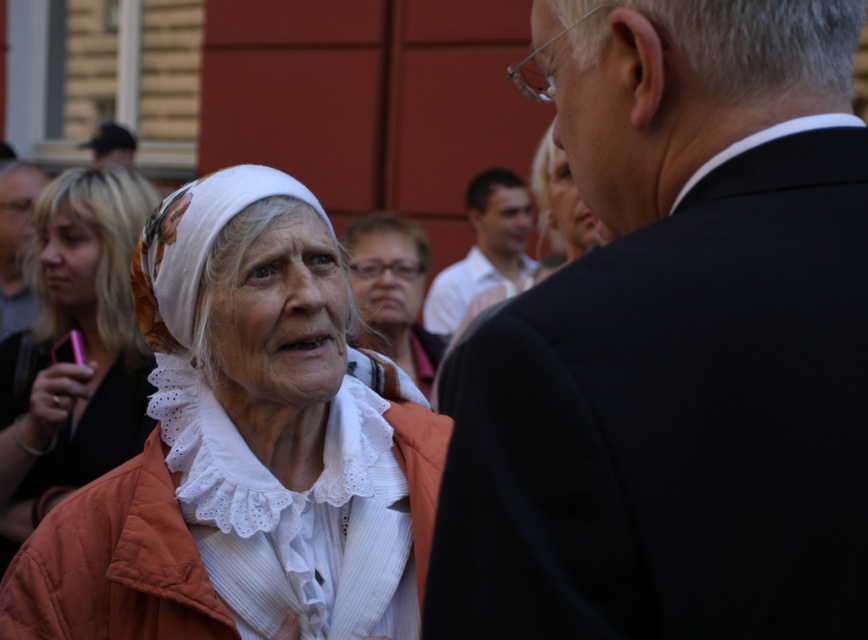
Question: Can you confirm if white lace blouse at lower left is thinner than white shirt at center?

Choices:
 (A) yes
 (B) no

Answer: (B)

Question: Which point is closer to the camera?

Choices:
 (A) (409, 243)
 (B) (505, 605)

Answer: (B)

Question: Among these points, which one is nearest to the camera?

Choices:
 (A) (30, 221)
 (B) (378, 445)
 (C) (485, 257)
 (D) (80, 232)

Answer: (B)

Question: Is dark suit at right in front of white lace blouse at lower left?

Choices:
 (A) yes
 (B) no

Answer: (A)

Question: Which is farther from the matte white scarf at center?

Choices:
 (A) white lace scarf at upper left
 (B) matte black suit at upper left

Answer: (A)

Question: Can you confirm if white lace blouse at lower left is wider than matte white scarf at center?

Choices:
 (A) no
 (B) yes

Answer: (B)